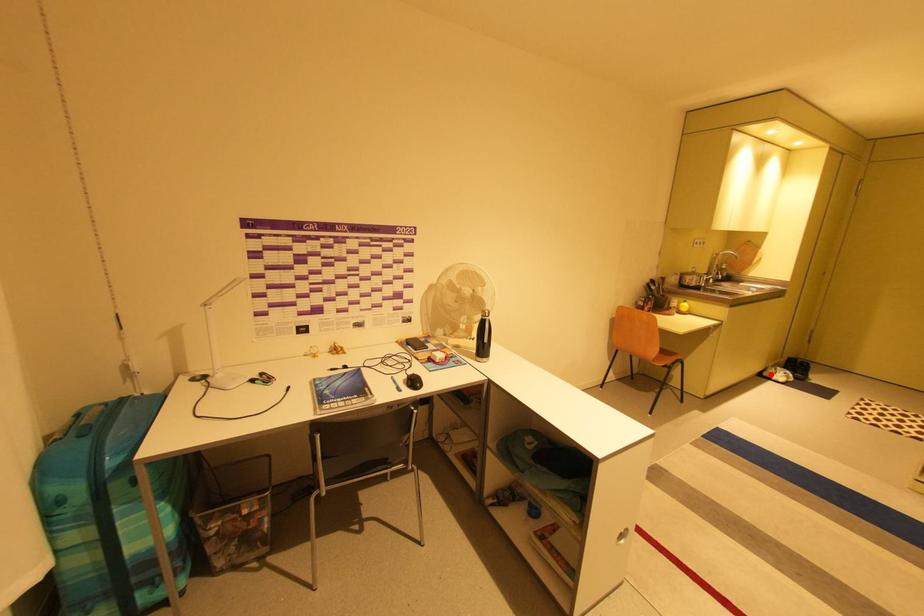
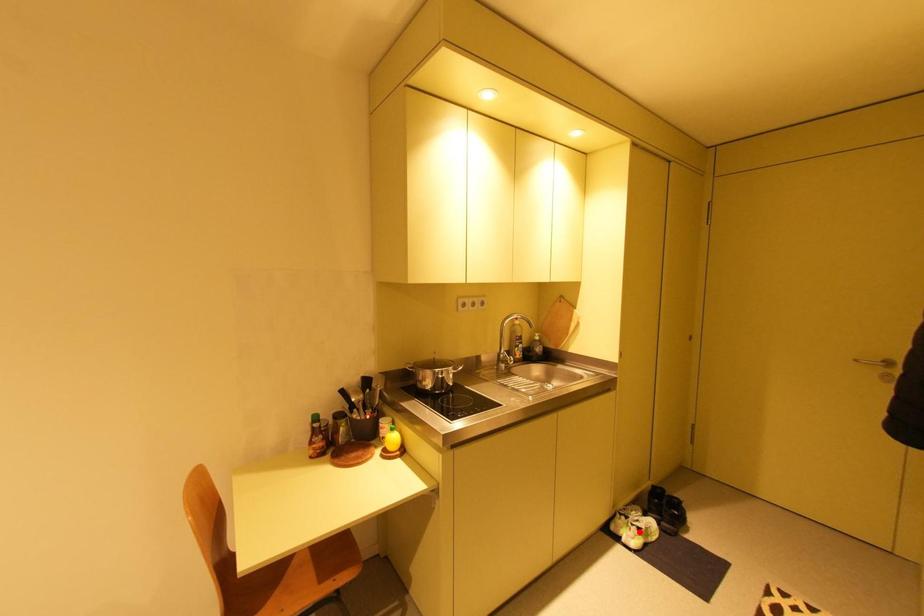
I am providing you with two images of the same scene from different viewpoints. A red point is marked on the first image and another point is marked on the second image. Are the points marked in image1 and image2 representing the same 3D position?

No